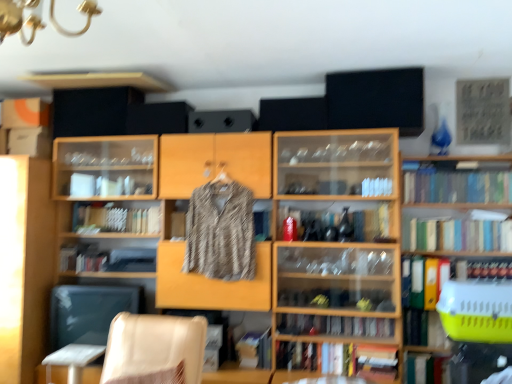
Question: From a real-world perspective, is green matte book at lower right, the eighth book viewed from the top, over wooden cabinet at left, marked as the 3th shelf in a right-to-left arrangement?

Choices:
 (A) yes
 (B) no

Answer: (B)

Question: Can wooden cabinet at left, positioned as the first shelf in left-to-right order, be found inside green matte book at lower right, the eighth book viewed from the top?

Choices:
 (A) no
 (B) yes

Answer: (A)

Question: Considering the relative positions of green matte book at lower right, the eighth book viewed from the top, and wooden cabinet at left, positioned as the first shelf in left-to-right order, in the image provided, is green matte book at lower right, the eighth book viewed from the top, to the right of wooden cabinet at left, positioned as the first shelf in left-to-right order, from the viewer's perspective?

Choices:
 (A) yes
 (B) no

Answer: (A)

Question: Is green matte book at lower right, the eighth book viewed from the top, smaller than wooden cabinet at left, positioned as the first shelf in left-to-right order?

Choices:
 (A) no
 (B) yes

Answer: (B)

Question: Could you tell me if green matte book at lower right, the first book from the bottom, is turned towards wooden cabinet at left, marked as the 3th shelf in a right-to-left arrangement?

Choices:
 (A) no
 (B) yes

Answer: (A)

Question: Is green matte book at lower right, the eighth book viewed from the top, to the left of wooden cabinet at left, positioned as the first shelf in left-to-right order, from the viewer's perspective?

Choices:
 (A) no
 (B) yes

Answer: (A)

Question: Is green matte book at lower right, the eighth book viewed from the top, closer to the viewer compared to green hardcover book at right, which is the 7th book from bottom to top?

Choices:
 (A) no
 (B) yes

Answer: (B)

Question: Is green matte book at lower right, the eighth book viewed from the top, not near green hardcover book at right, which is the 7th book from bottom to top?

Choices:
 (A) yes
 (B) no

Answer: (B)

Question: Can you confirm if green matte book at lower right, the eighth book viewed from the top, is smaller than green hardcover book at right, which is the 7th book from bottom to top?

Choices:
 (A) no
 (B) yes

Answer: (B)

Question: Is green matte book at lower right, the eighth book viewed from the top, oriented away from green hardcover book at right, the second book positioned from the top?

Choices:
 (A) yes
 (B) no

Answer: (B)

Question: Is green matte book at lower right, the eighth book viewed from the top, taller than green hardcover book at right, which is the 7th book from bottom to top?

Choices:
 (A) yes
 (B) no

Answer: (A)

Question: From the image's perspective, would you say green matte book at lower right, the first book from the bottom, is shown under green hardcover book at right, which is the 7th book from bottom to top?

Choices:
 (A) yes
 (B) no

Answer: (A)

Question: Is green matte book at lower right, the first book from the bottom, further to camera compared to wooden bookcase at center?

Choices:
 (A) no
 (B) yes

Answer: (B)